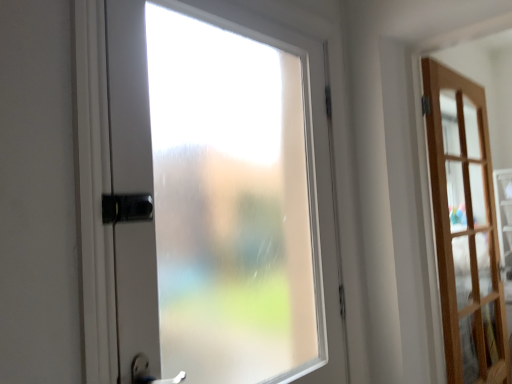
Question: In terms of width, does frosted glass door at center, which ranks as the 2th door in back-to-front order, look wider or thinner when compared to light brown wooden door at right, the 2th door from the left?

Choices:
 (A) wide
 (B) thin

Answer: (B)

Question: From the image's perspective, is frosted glass door at center, marked as the 1th door in a left-to-right arrangement, positioned above or below light brown wooden door at right, which ranks as the second door in front-to-back order?

Choices:
 (A) above
 (B) below

Answer: (A)

Question: From a real-world perspective, is frosted glass door at center, the 1th door viewed from the front, positioned above or below light brown wooden door at right, the 1th door in the back-to-front sequence?

Choices:
 (A) above
 (B) below

Answer: (A)

Question: Do you think light brown wooden door at right, which ranks as the second door in front-to-back order, is within frosted glass door at center, which ranks as the 2th door in back-to-front order, or outside of it?

Choices:
 (A) inside
 (B) outside

Answer: (B)

Question: Is light brown wooden door at right, the 2th door from the left, taller or shorter than frosted glass door at center, arranged as the 2th door when viewed from the right?

Choices:
 (A) short
 (B) tall

Answer: (B)

Question: From the image's perspective, is light brown wooden door at right, which appears as the 1th door when viewed from the right, above or below frosted glass door at center, arranged as the 2th door when viewed from the right?

Choices:
 (A) above
 (B) below

Answer: (B)

Question: Is light brown wooden door at right, which ranks as the second door in front-to-back order, in front of or behind frosted glass door at center, the 1th door viewed from the front, in the image?

Choices:
 (A) front
 (B) behind

Answer: (B)